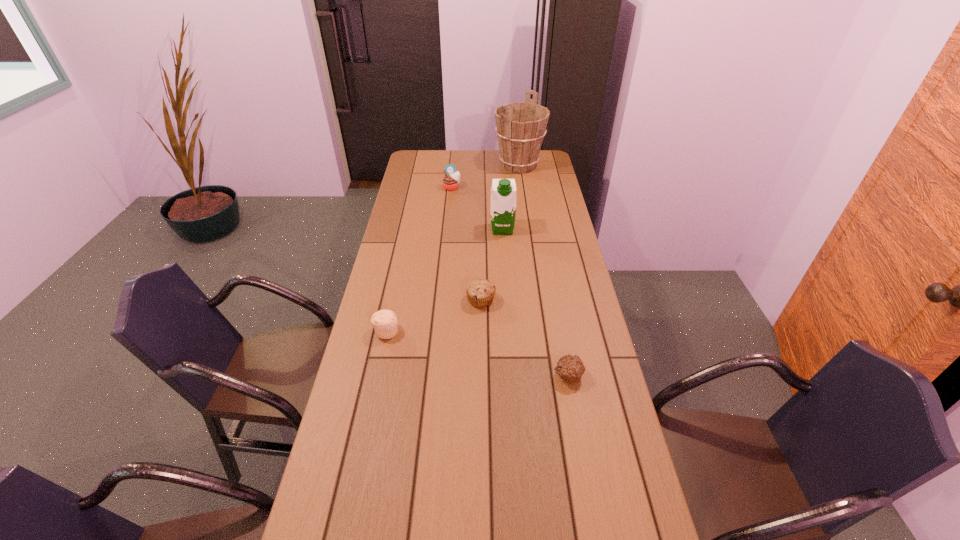
The image size is (960, 540). In order to click on vacant region between the soya milk and the nearest muffin in this screenshot , I will do `click(536, 302)`.

This screenshot has height=540, width=960. I want to click on free space between the soya milk and the leftmost object, so click(x=444, y=280).

I want to click on blank region between the bucket and the second nearest muffin, so (452, 248).

Locate an element on the screen. Image resolution: width=960 pixels, height=540 pixels. empty location between the leftmost object and the shortest muffin is located at coordinates (477, 353).

The width and height of the screenshot is (960, 540). I want to click on free space between the second muffin from left to right and the leftmost object, so click(x=420, y=259).

Where is `unoccupied position between the nearest muffin and the soya milk`? Image resolution: width=960 pixels, height=540 pixels. unoccupied position between the nearest muffin and the soya milk is located at coordinates (536, 302).

I want to click on object that is the nearest to the nearest object, so click(480, 292).

Where is `object that stands as the fifth closest to the shortest object`? The width and height of the screenshot is (960, 540). object that stands as the fifth closest to the shortest object is located at coordinates (520, 126).

Select which muffin appears as the closest to the nearest object. Please provide its 2D coordinates. Your answer should be formatted as a tuple, i.e. [(x, y)], where the tuple contains the x and y coordinates of a point satisfying the conditions above.

[(480, 292)]

Locate which muffin is the fourth closest to the fourth nearest object. Please provide its 2D coordinates. Your answer should be formatted as a tuple, i.e. [(x, y)], where the tuple contains the x and y coordinates of a point satisfying the conditions above.

[(570, 368)]